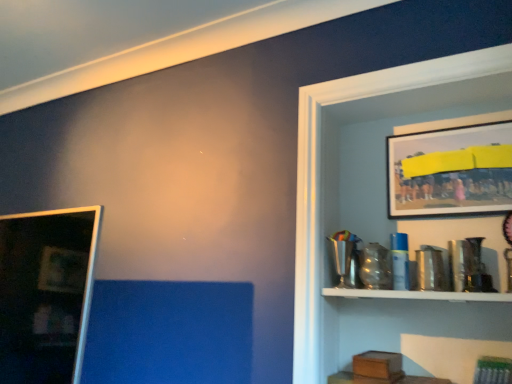
Question: Can you confirm if metallic framed picture at upper right, the first picture frame when ordered from right to left, is positioned to the left of metallic silver shelf at upper right?

Choices:
 (A) no
 (B) yes

Answer: (A)

Question: Is metallic framed picture at upper right, the second picture frame viewed from the left, completely or partially outside of metallic silver shelf at upper right?

Choices:
 (A) no
 (B) yes

Answer: (A)

Question: Is metallic framed picture at upper right, placed as the first picture frame when sorted from top to bottom, positioned far away from metallic silver shelf at upper right?

Choices:
 (A) no
 (B) yes

Answer: (A)

Question: Is metallic framed picture at upper right, the second picture frame viewed from the left, surrounding metallic silver shelf at upper right?

Choices:
 (A) yes
 (B) no

Answer: (B)

Question: From a real-world perspective, is metallic framed picture at upper right, the second picture frame viewed from the left, positioned under metallic silver shelf at upper right based on gravity?

Choices:
 (A) no
 (B) yes

Answer: (A)

Question: From the image's perspective, is metallic framed picture at upper right, the 2th picture frame in the bottom-to-top sequence, over metallic silver shelf at upper right?

Choices:
 (A) no
 (B) yes

Answer: (B)

Question: Is matte black picture frame at left, which ranks as the second picture frame in top-to-bottom order, not close to metallic silver shelf at upper right?

Choices:
 (A) no
 (B) yes

Answer: (A)

Question: Considering the relative sizes of matte black picture frame at left, which ranks as the second picture frame in right-to-left order, and metallic silver shelf at upper right in the image provided, is matte black picture frame at left, which ranks as the second picture frame in right-to-left order, wider than metallic silver shelf at upper right?

Choices:
 (A) no
 (B) yes

Answer: (A)

Question: Is metallic silver shelf at upper right completely or partially inside matte black picture frame at left, which ranks as the second picture frame in right-to-left order?

Choices:
 (A) yes
 (B) no

Answer: (B)

Question: From a real-world perspective, is matte black picture frame at left, the first picture frame positioned from the bottom, below metallic silver shelf at upper right?

Choices:
 (A) yes
 (B) no

Answer: (A)

Question: From the image's perspective, does matte black picture frame at left, which ranks as the second picture frame in top-to-bottom order, appear higher than metallic silver shelf at upper right?

Choices:
 (A) yes
 (B) no

Answer: (B)

Question: Considering the relative sizes of matte black picture frame at left, which ranks as the second picture frame in right-to-left order, and metallic silver shelf at upper right in the image provided, is matte black picture frame at left, which ranks as the second picture frame in right-to-left order, thinner than metallic silver shelf at upper right?

Choices:
 (A) no
 (B) yes

Answer: (B)

Question: Is metallic silver shelf at upper right looking in the opposite direction of metallic framed picture at upper right, the 2th picture frame in the bottom-to-top sequence?

Choices:
 (A) yes
 (B) no

Answer: (A)